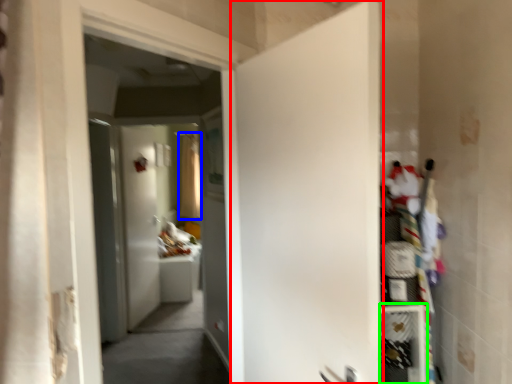
Question: Which object is positioned closest to door (highlighted by a red box)? Select from curtain (highlighted by a blue box) and shelf (highlighted by a green box).

Choices:
 (A) curtain
 (B) shelf

Answer: (B)